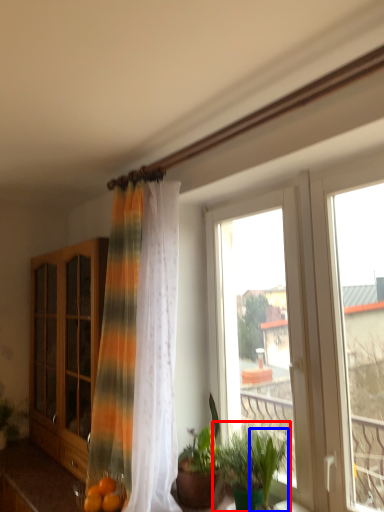
Question: Among these objects, which one is nearest to the camera, houseplant (highlighted by a red box) or plant (highlighted by a blue box)?

Choices:
 (A) houseplant
 (B) plant

Answer: (B)